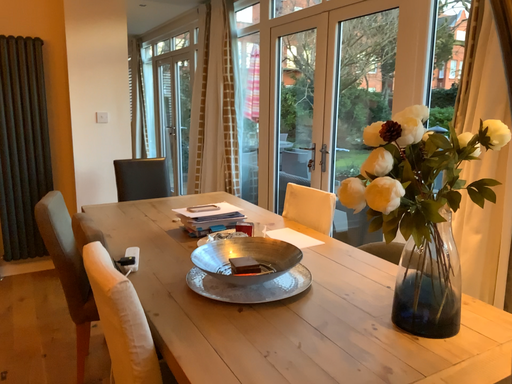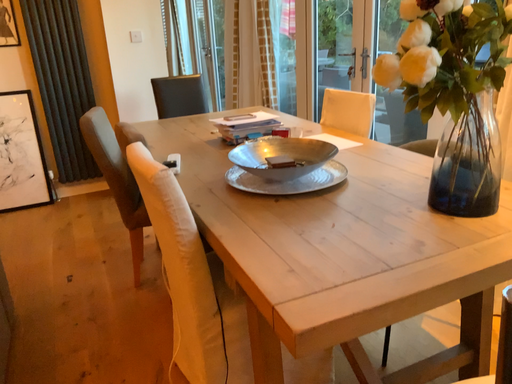
Question: Which way did the camera rotate in the video?

Choices:
 (A) rotated upward
 (B) rotated downward

Answer: (B)